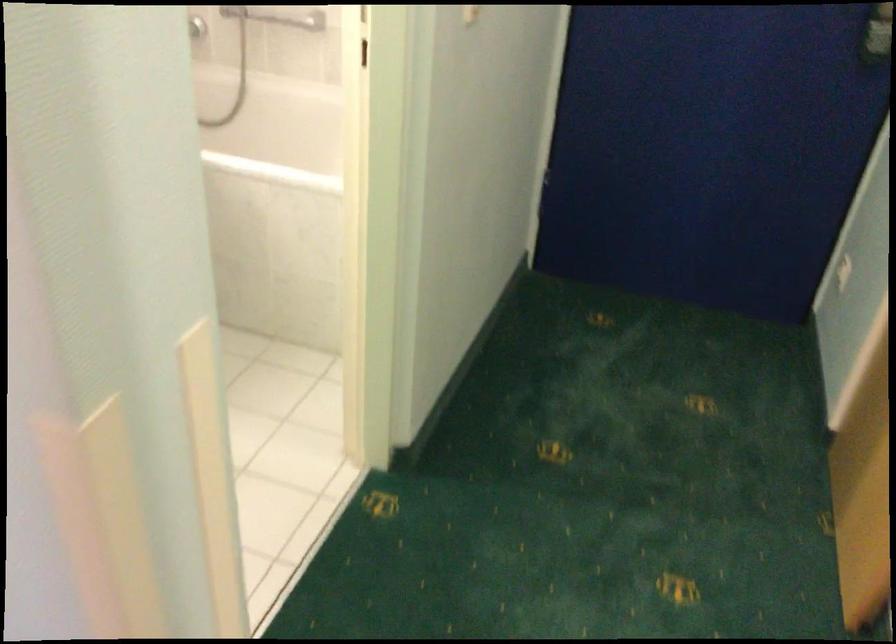
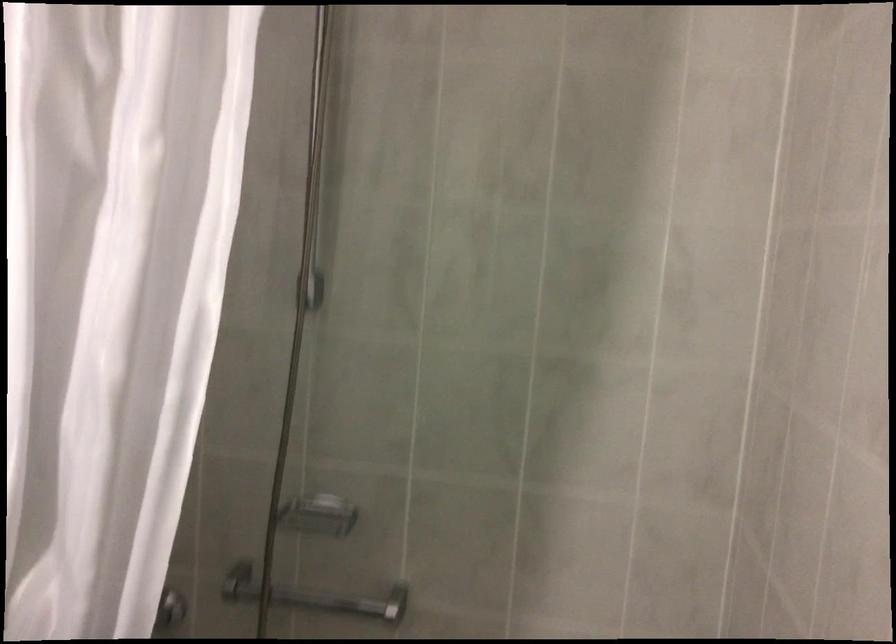
The images are taken continuously from a first-person perspective. In which direction are you moving?

The movement direction of the cameraman is left, forward.